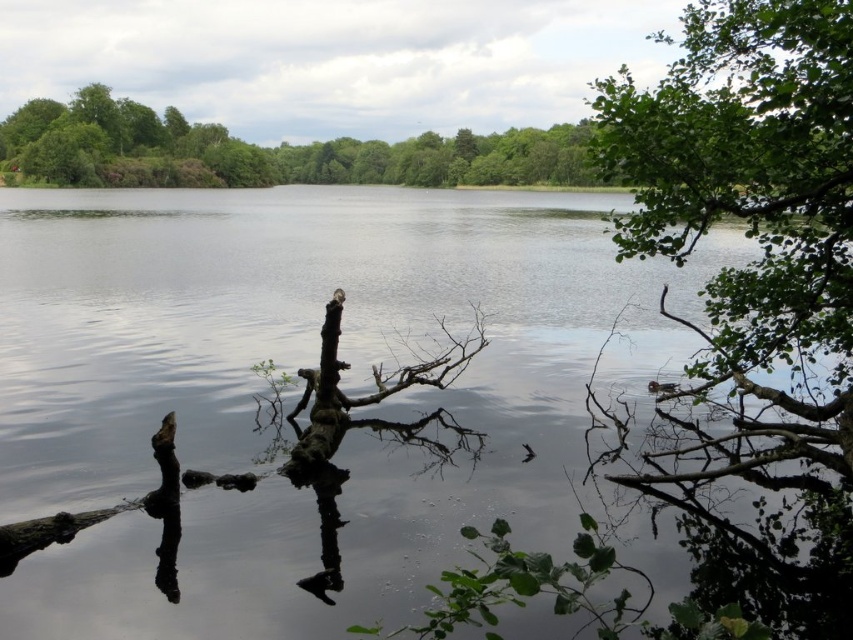
You are standing at the lakeside and want to take a photo of the brown rough branch at center and the green leafy trees at upper center. Which object should you adjust your camera to focus on first if you want both to be in the frame?

The green leafy trees at upper center should be focused on first since they are positioned to the left of the brown rough branch at center, allowing both to be captured in the frame by adjusting the camera angle accordingly.

You are standing at the lakeside and want to reach the brown rough branch at center without getting your feet wet. Can you step onto the transparent water at center to do so?

The transparent water at center is closer to the viewer than the brown rough branch at center, so stepping onto the transparent water at center would get your feet wet because it is between you and the branch.

You are a kayaker planning to paddle through the center of the lake. You notice the transparent water at center and the brown rough branch at center. Which object is higher in elevation compared to the other?

The transparent water at center is taller than the brown rough branch at center, so the water is higher in elevation.